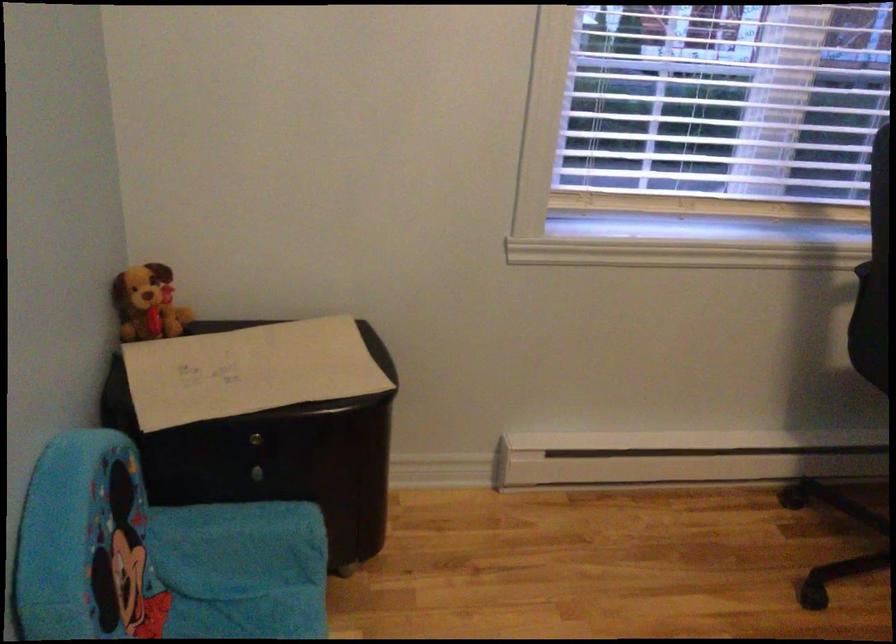
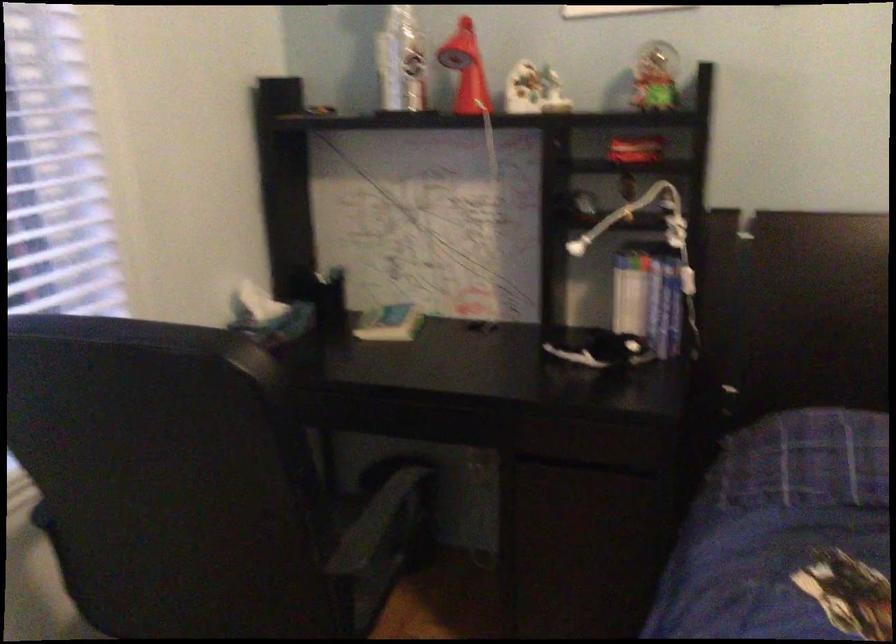
Question: The camera is either moving clockwise (left) or counter-clockwise (right) around the object. The first image is from the beginning of the video and the second image is from the end. Is the camera moving left or right when shooting the video?

Choices:
 (A) Left
 (B) Right

Answer: (A)